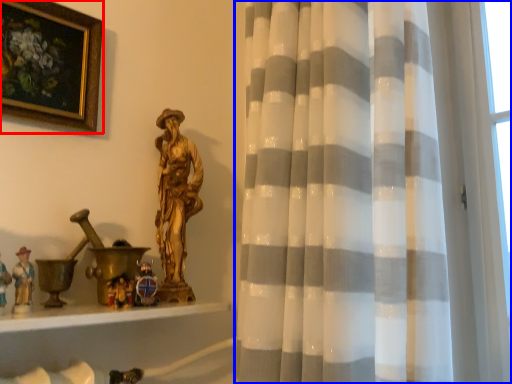
Question: Which object appears closest to the camera in this image, picture frame (highlighted by a red box) or curtain (highlighted by a blue box)?

Choices:
 (A) picture frame
 (B) curtain

Answer: (B)